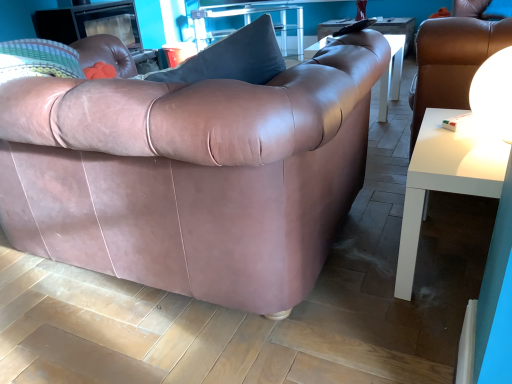
Locate an element on the screen. Image resolution: width=512 pixels, height=384 pixels. vacant space situated on the left part of white glossy table at lower right, arranged as the second table when viewed from the top is located at coordinates (358, 277).